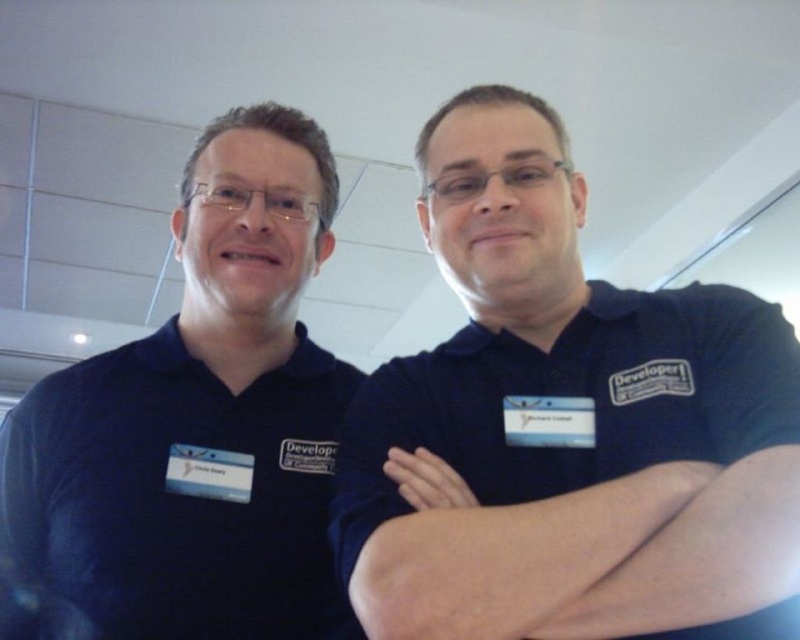
You are organizing a team photo and need to ensure that all shirts are visible. Given that the dark blue shirt at center and the dark blue shirt at left are both part of the team, which shirt should you adjust to ensure the wider one is centered?

The dark blue shirt at center is wider than the dark blue shirt at left. Therefore, you should adjust the dark blue shirt at center to ensure it is centered in the photo.

You are organizing a team photo and need to arrange the developers in order from front to back. Given the dark blue shirt at center and the dark blue shirt at left, which one should be placed in front?

The dark blue shirt at center should be placed in front because it is in front of the dark blue shirt at left in the image.